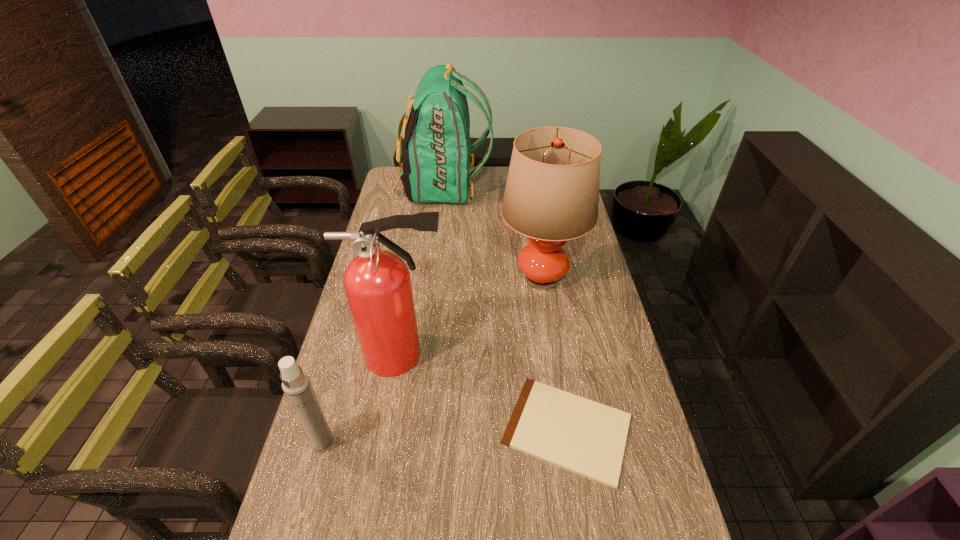
This screenshot has height=540, width=960. In order to click on backpack in this screenshot , I will do `click(436, 160)`.

The image size is (960, 540). In order to click on lamp in this screenshot , I will do `click(552, 191)`.

Where is `the third nearest object`? The image size is (960, 540). the third nearest object is located at coordinates [377, 282].

What are the coordinates of `aerosol can` in the screenshot? It's located at (296, 385).

The image size is (960, 540). I want to click on the shortest object, so click(x=583, y=436).

You are a GUI agent. You are given a task and a screenshot of the screen. Output one action in this format:
    pyautogui.click(x=<x>, y=<y>)
    Task: Click on the vacant space situated on the back of the backpack
    The image size is (960, 540).
    Given the screenshot: What is the action you would take?
    pyautogui.click(x=527, y=190)

In order to click on free space located on the front of the second farthest object in this screenshot , I will do `click(559, 396)`.

At what (x,y) coordinates should I click in order to perform the action: click on vacant space situated 0.290m on the front of the fire extinguisher. Please return your answer as a coordinate pair (x, y). The height and width of the screenshot is (540, 960). Looking at the image, I should click on (383, 478).

Identify the location of vacant area situated on the back of the second shortest object. (347, 357).

At what (x,y) coordinates should I click in order to perform the action: click on vacant space located on the back of the shortest object. Please return your answer as a coordinate pair (x, y). This screenshot has height=540, width=960. Looking at the image, I should click on (549, 318).